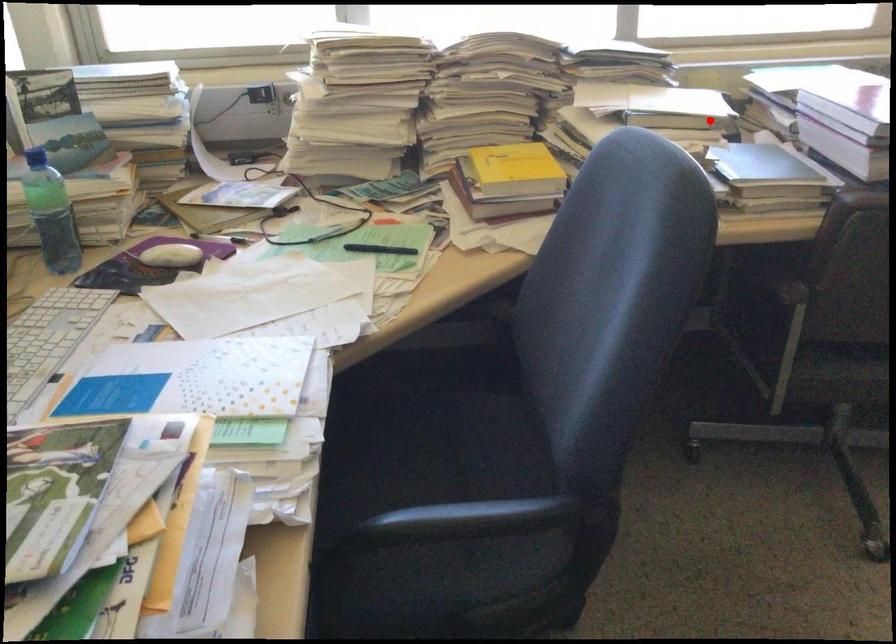
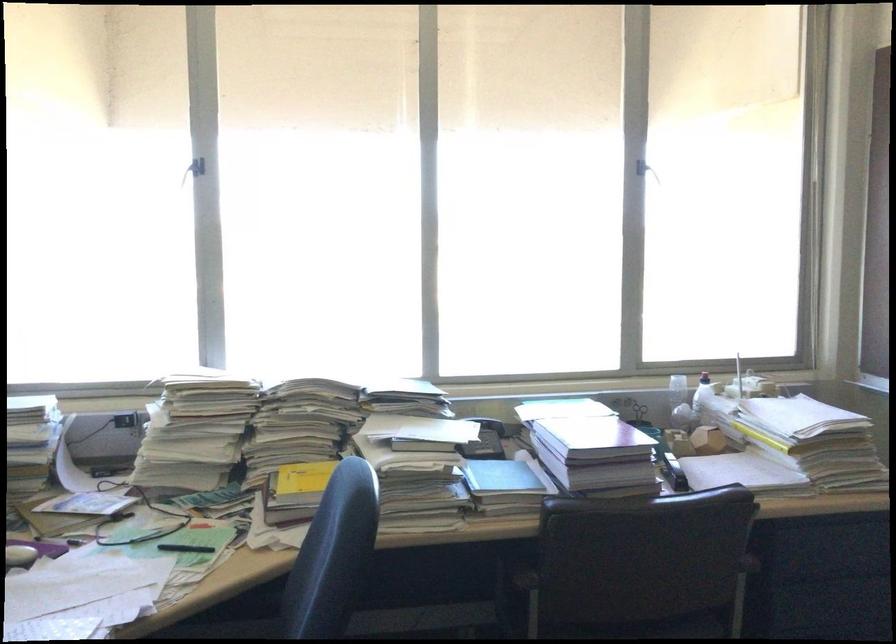
Question: A red point is marked in image1. In image2, is the corresponding 3D point closer to the camera or farther? Reply with the corresponding letter.

Choices:
 (A) The corresponding 3D point is closer.
 (B) The corresponding 3D point is farther.

Answer: (B)